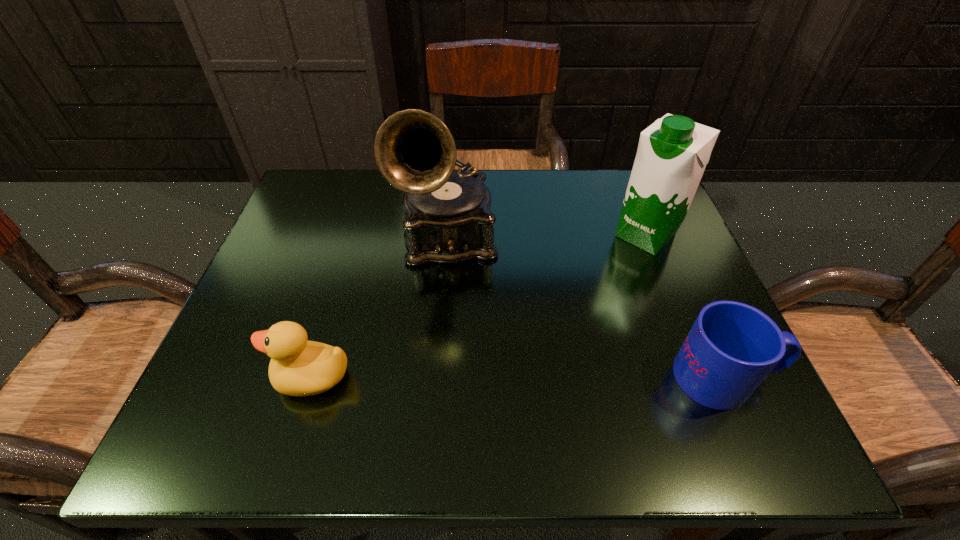
In order to click on duck in this screenshot , I will do [298, 367].

Image resolution: width=960 pixels, height=540 pixels. What are the coordinates of `mug` in the screenshot? It's located at (731, 348).

The image size is (960, 540). In order to click on the tallest object in this screenshot , I will do `click(448, 220)`.

In order to click on phonograph record in this screenshot , I will do `click(448, 220)`.

Where is `the third shortest object`? Image resolution: width=960 pixels, height=540 pixels. the third shortest object is located at coordinates (672, 154).

Where is `blank area located 0.220m on the horn of the phonograph record`? The width and height of the screenshot is (960, 540). blank area located 0.220m on the horn of the phonograph record is located at coordinates (462, 376).

Identify the location of free space located on the horn of the phonograph record. (462, 376).

Image resolution: width=960 pixels, height=540 pixels. In order to click on vacant region located 0.220m on the horn of the phonograph record in this screenshot , I will do `click(462, 376)`.

Where is `vacant space positioned on the front-facing side of the third shortest object`? The width and height of the screenshot is (960, 540). vacant space positioned on the front-facing side of the third shortest object is located at coordinates (561, 319).

I want to click on vacant space situated 0.380m on the front-facing side of the third shortest object, so click(516, 363).